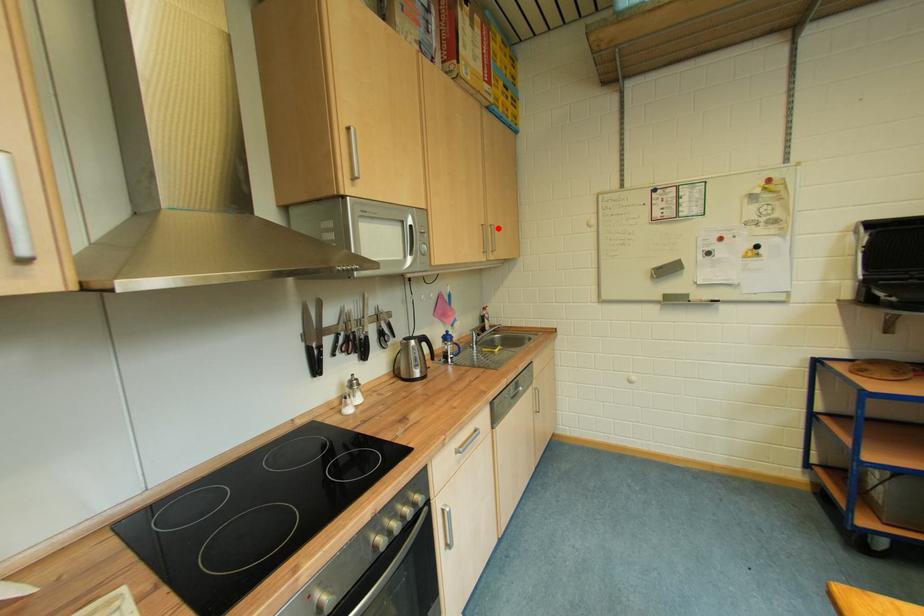
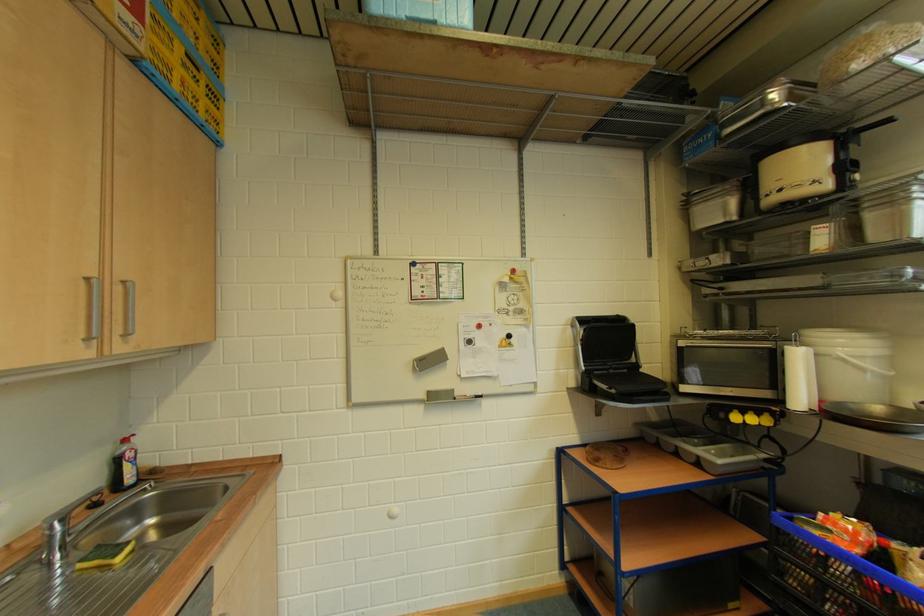
Where in the second image is the point corresponding to the highlighted location from the first image?

(130, 285)